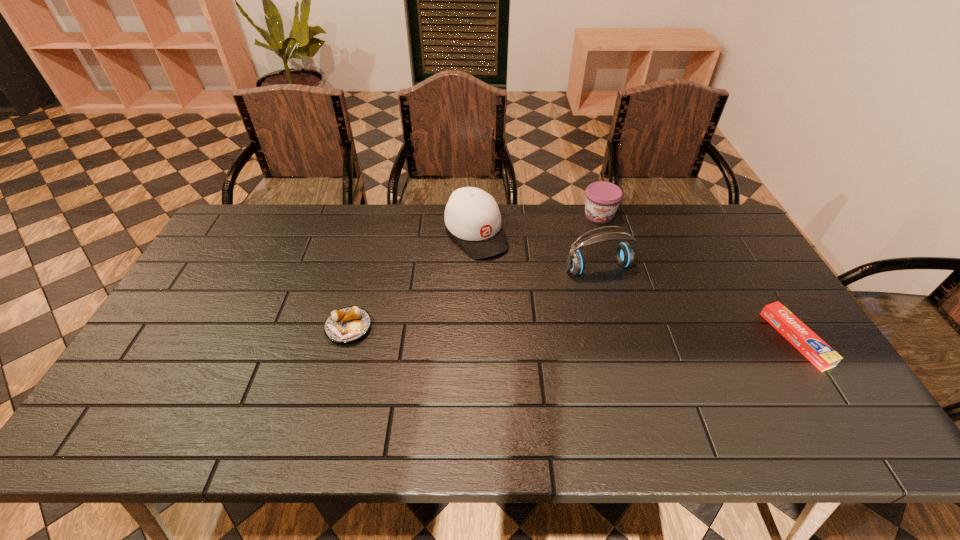
This screenshot has width=960, height=540. In order to click on vacant area that lies between the headset and the toothpaste in this screenshot , I will do `click(697, 303)`.

Find the location of `free space between the headset and the shortest object`. free space between the headset and the shortest object is located at coordinates (697, 303).

You are a GUI agent. You are given a task and a screenshot of the screen. Output one action in this format:
    pyautogui.click(x=<x>, y=<y>)
    Task: Click on the vacant area that lies between the headset and the shortest object
    This screenshot has height=540, width=960.
    Given the screenshot: What is the action you would take?
    pyautogui.click(x=697, y=303)

You are a GUI agent. You are given a task and a screenshot of the screen. Output one action in this format:
    pyautogui.click(x=<x>, y=<y>)
    Task: Click on the vacant space that is in between the headset and the toothpaste
    Image resolution: width=960 pixels, height=540 pixels.
    Given the screenshot: What is the action you would take?
    pyautogui.click(x=697, y=303)

Identify the location of free spot between the leftmost object and the second object from left to right. The height and width of the screenshot is (540, 960). click(413, 281).

The height and width of the screenshot is (540, 960). In order to click on vacant area that lies between the jam and the shortest object in this screenshot , I will do `click(697, 277)`.

Where is `empty location between the jam and the baseball cap`? This screenshot has width=960, height=540. empty location between the jam and the baseball cap is located at coordinates (538, 225).

Where is `the second closest object to the fourth tallest object`? Image resolution: width=960 pixels, height=540 pixels. the second closest object to the fourth tallest object is located at coordinates (624, 253).

What are the coordinates of `object that stands as the fourth closest to the fourth object from right to left` in the screenshot? It's located at (819, 353).

In order to click on free location that satisfies the following two spatial constraints: 1. on the front side of the rightmost object; 2. on the left side of the fourth tallest object in this screenshot , I will do point(346,339).